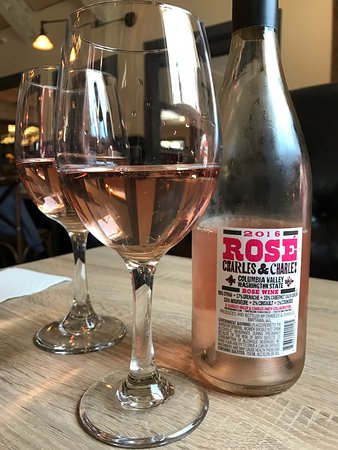
Where is `wall`? The width and height of the screenshot is (338, 450). wall is located at coordinates (320, 50).